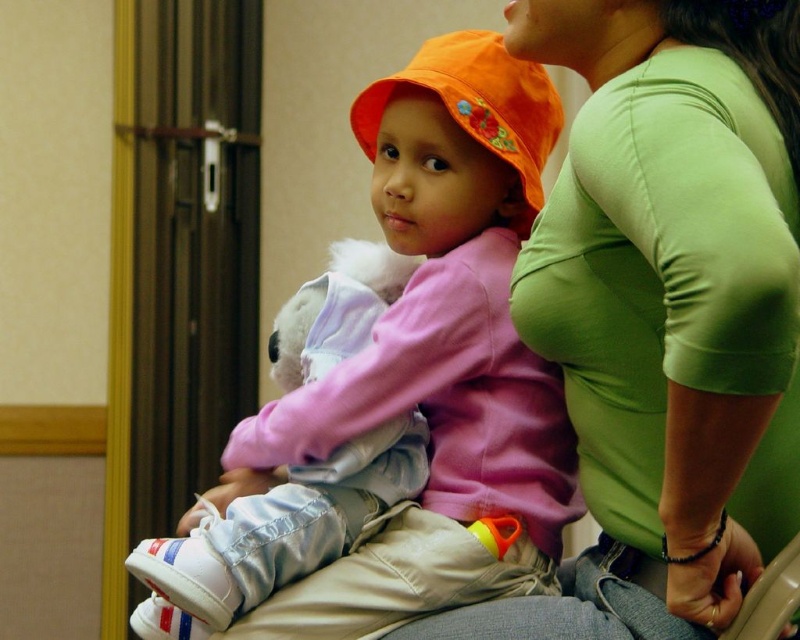
Question: Which object is the closest to the green matte shirt at upper right?

Choices:
 (A) orange fabric hat at center
 (B) matte pink sweater at center

Answer: (B)

Question: Can you confirm if matte pink sweater at center is positioned above orange fabric hat at center?

Choices:
 (A) yes
 (B) no

Answer: (B)

Question: Which object is the farthest from the orange fabric hat at center?

Choices:
 (A) green matte shirt at upper right
 (B) matte pink sweater at center

Answer: (A)

Question: Considering the real-world distances, which object is closest to the matte pink sweater at center?

Choices:
 (A) green matte shirt at upper right
 (B) orange fabric hat at center

Answer: (B)

Question: Is green matte shirt at upper right below orange fabric hat at center?

Choices:
 (A) no
 (B) yes

Answer: (B)

Question: Does matte pink sweater at center appear over orange fabric hat at center?

Choices:
 (A) yes
 (B) no

Answer: (B)